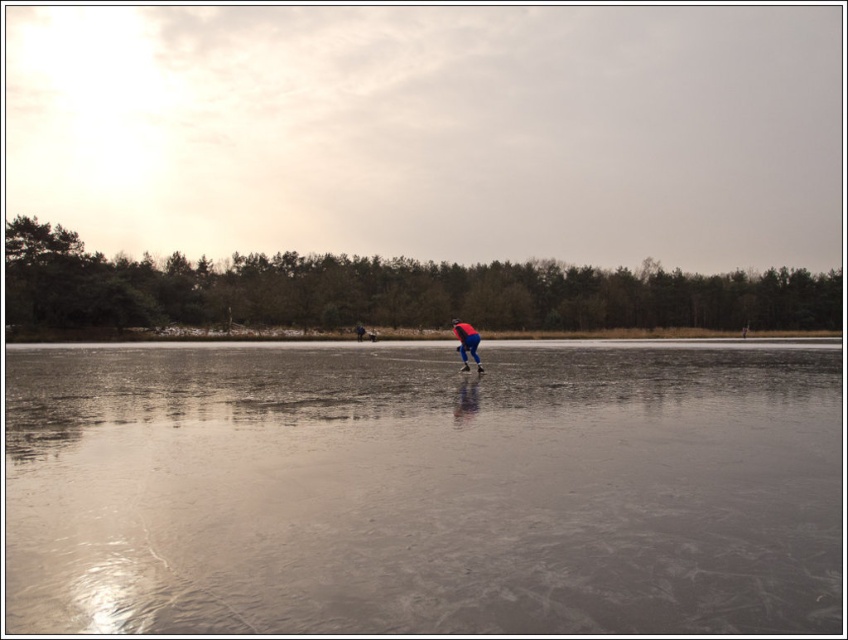
You are an ice skater standing on the frozen lake. You notice the transparent ice at center and blue fabric pants at center. Which object is closer to the ground?

The transparent ice at center is located below blue fabric pants at center, so it is closer to the ground.

You are a photographer planning to capture the winter scene. You want to ensure the transparent ice at center and the blue fabric pants at center are both clearly visible in your photo. Which object should you focus on first to ensure depth of field captures both?

The transparent ice at center is taller than blue fabric pants at center. To ensure both are in focus, you should focus on the transparent ice at center first since it is farther away, allowing the depth of field to cover the closer blue fabric pants at center.

You are standing at the point marked as point (343, 586) on the frozen lake. If you want to reach the dense line of trees in the background, which direction should you move relative to your current position?

Since the point (343, 586) is 4.67 meters away from the viewer, you should move towards the background where the dense line of trees is located to reach them.